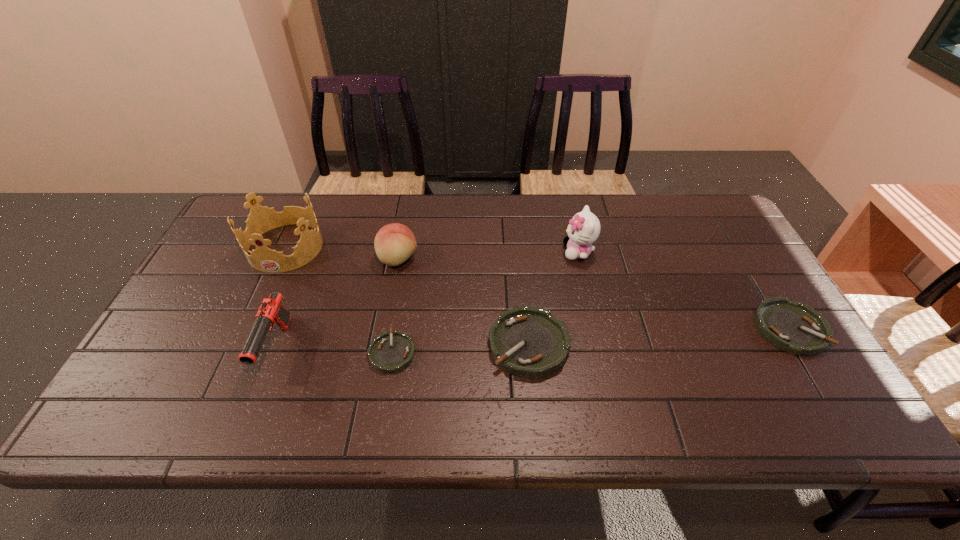
At what (x,y) coordinates should I click in order to perform the action: click on vacant area that lies between the leftmost ashtray and the tiara. Please return your answer as a coordinate pair (x, y). Looking at the image, I should click on (339, 300).

Locate an element on the screen. The height and width of the screenshot is (540, 960). unoccupied position between the shortest object and the gun is located at coordinates point(334,350).

Identify the location of vacant area that lies between the sixth object from left to right and the shortest ashtray. This screenshot has width=960, height=540. (486, 302).

The image size is (960, 540). I want to click on vacant area that lies between the kitten and the gun, so click(427, 300).

Identify the location of vacant space that's between the shortest ashtray and the kitten. (486, 302).

I want to click on the closest object to the gun, so click(261, 219).

Find the location of `object that is the third closest one to the tiara`. object that is the third closest one to the tiara is located at coordinates (390, 352).

At what (x,y) coordinates should I click in order to perform the action: click on ashtray object that ranks as the second closest to the fifth object from left to right. Please return your answer as a coordinate pair (x, y). This screenshot has height=540, width=960. Looking at the image, I should click on (795, 327).

I want to click on ashtray that stands as the third closest to the tiara, so click(795, 327).

Where is `free region that satisfies the following two spatial constraints: 1. on the front-facing side of the second shortest object; 2. on the right side of the second object from right to left`? The height and width of the screenshot is (540, 960). free region that satisfies the following two spatial constraints: 1. on the front-facing side of the second shortest object; 2. on the right side of the second object from right to left is located at coordinates (595, 328).